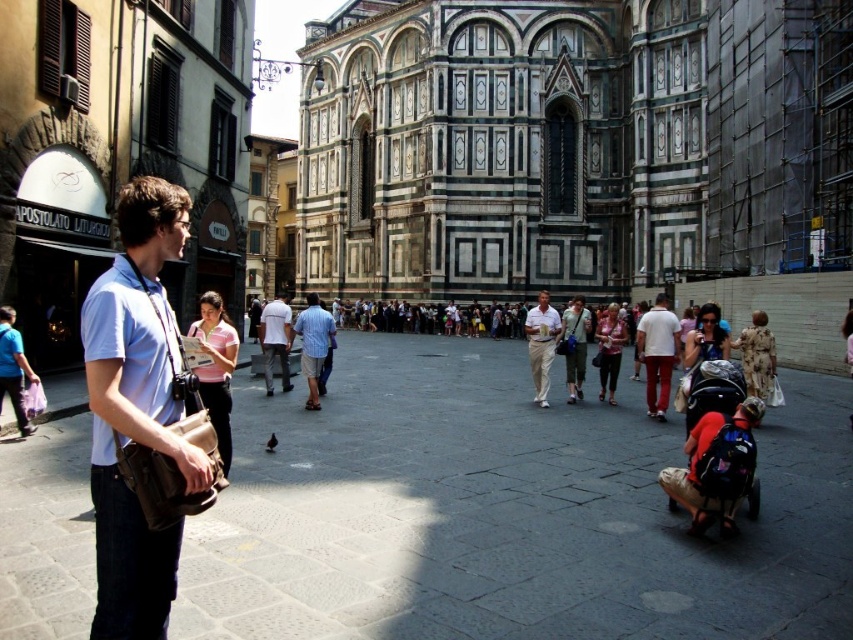
Who is higher up, light blue fabric shirt at left or blue striped shirt at center?

light blue fabric shirt at left is higher up.

Locate an element on the screen. This screenshot has height=640, width=853. light blue fabric shirt at left is located at coordinates (136, 410).

Where is `light blue fabric shirt at left`? light blue fabric shirt at left is located at coordinates (136, 410).

Who is more forward, (207, 307) or (653, 307)?

Positioned in front is point (207, 307).

I want to click on pink fabric shirt at center, so click(x=216, y=369).

This screenshot has width=853, height=640. What do you see at coordinates (573, 346) in the screenshot?
I see `green canvas backpack at center` at bounding box center [573, 346].

Is point (584, 340) in front of point (596, 324)?

Yes.

Image resolution: width=853 pixels, height=640 pixels. Identify the location of green canvas backpack at center. (573, 346).